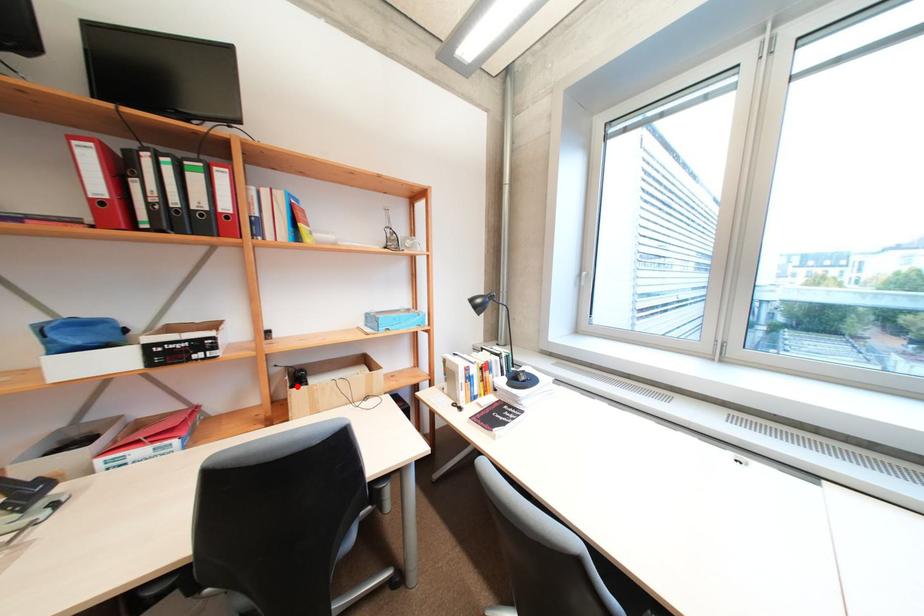
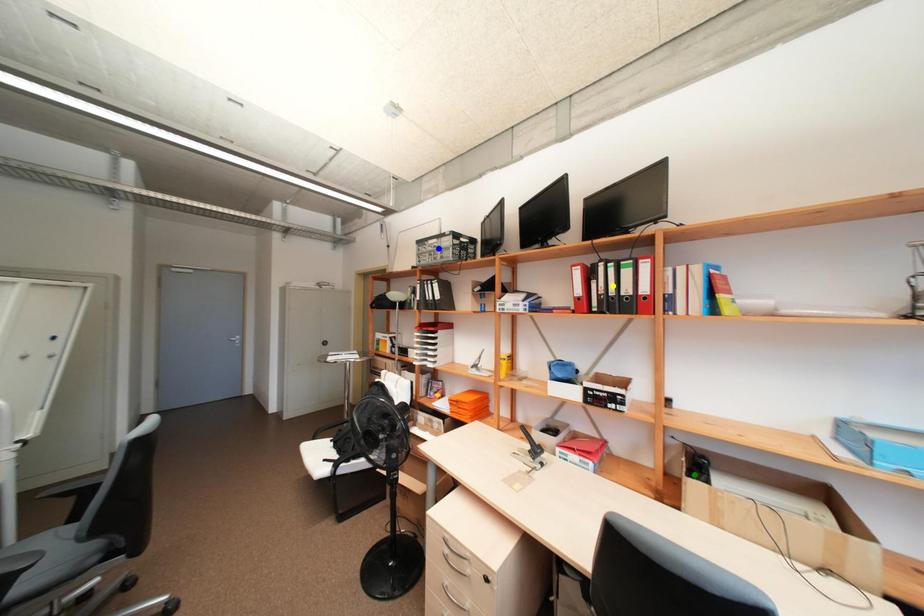
Question: I am providing you with two images of the same scene from different viewpoints. A red point is marked on the first image. You are given multiple points on the second image. Which point in image 2 represents the same 3d spot as the red point in image 1?

Choices:
 (A) green point
 (B) yellow point
 (C) blue point

Answer: (A)